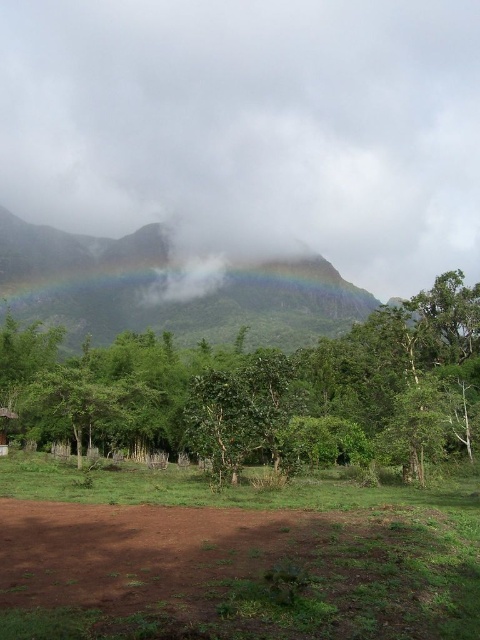
Question: Which point appears farthest from the camera in this image?

Choices:
 (A) (396, 401)
 (B) (334, 228)
 (C) (52, 563)
 (D) (1, 438)

Answer: (B)

Question: Can you confirm if rainbow at upper center is positioned below brown wooden hut at lower left?

Choices:
 (A) no
 (B) yes

Answer: (A)

Question: Estimate the real-world distances between objects in this image. Which object is farther from the brown soil at lower left?

Choices:
 (A) green leafy tree at center
 (B) rainbow at upper center

Answer: (B)

Question: Is brown soil at lower left closer to the viewer compared to green leafy tree at center?

Choices:
 (A) no
 (B) yes

Answer: (B)

Question: Which object appears farthest from the camera in this image?

Choices:
 (A) green leafy tree at center
 (B) rainbow at upper center

Answer: (B)

Question: Observing the image, what is the correct spatial positioning of rainbow at upper center in reference to brown soil at lower left?

Choices:
 (A) right
 (B) left

Answer: (A)